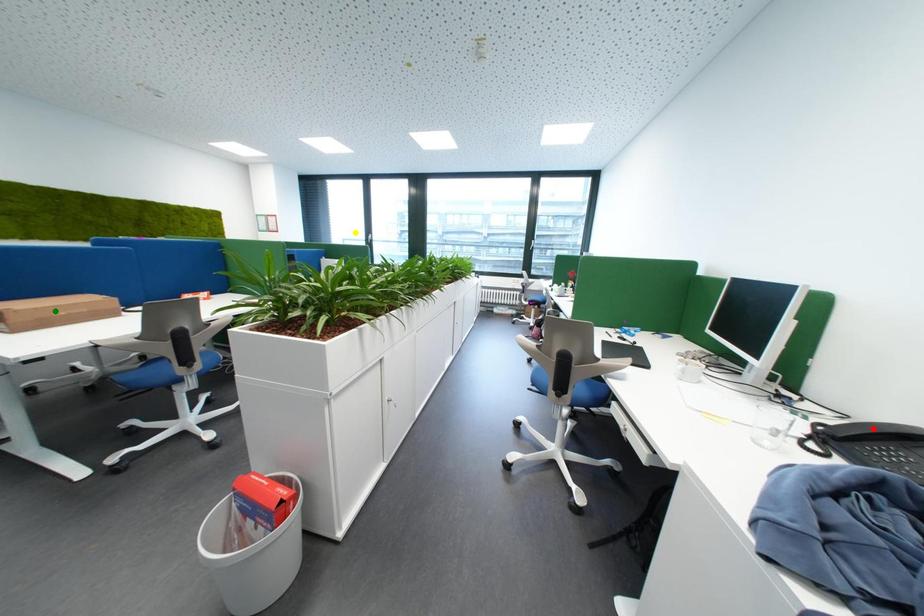
Order these from nearest to farthest:
red point | green point | yellow point

1. red point
2. green point
3. yellow point